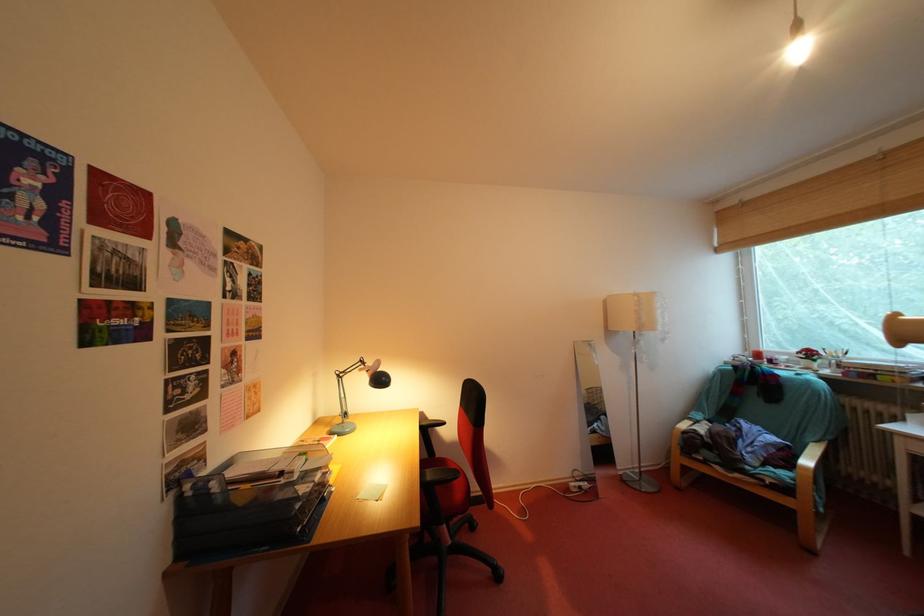
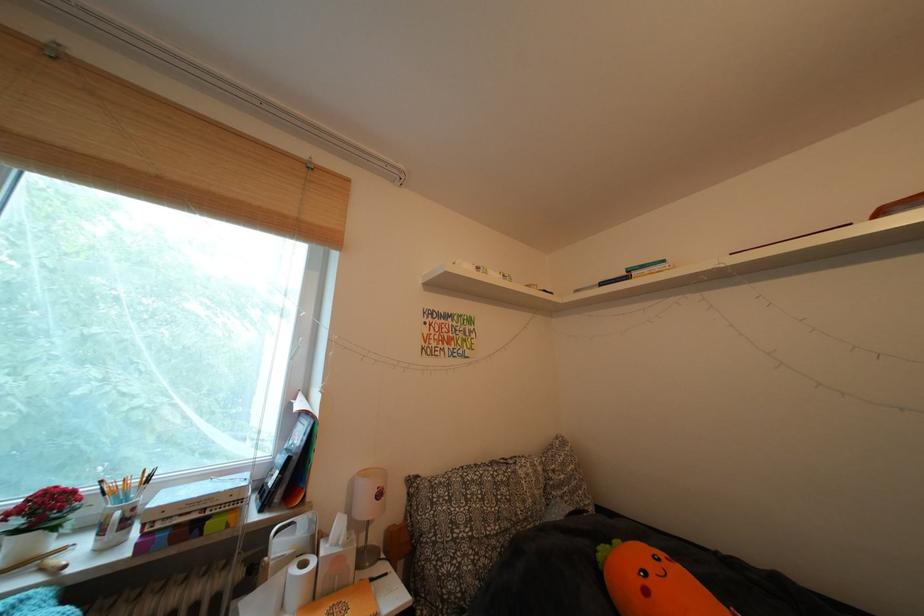
Where in the second image is the point corresponding to [820,360] from the first image?

(56, 513)